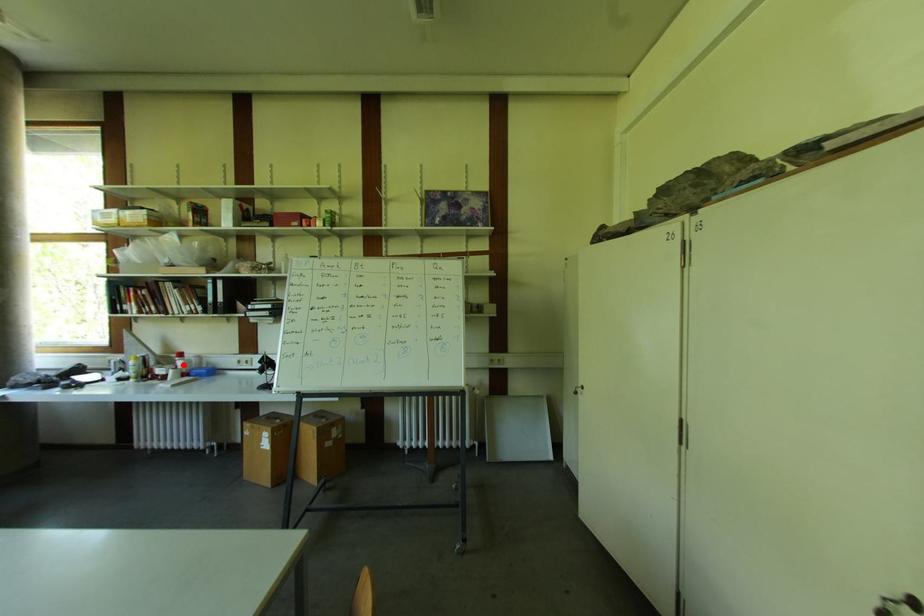
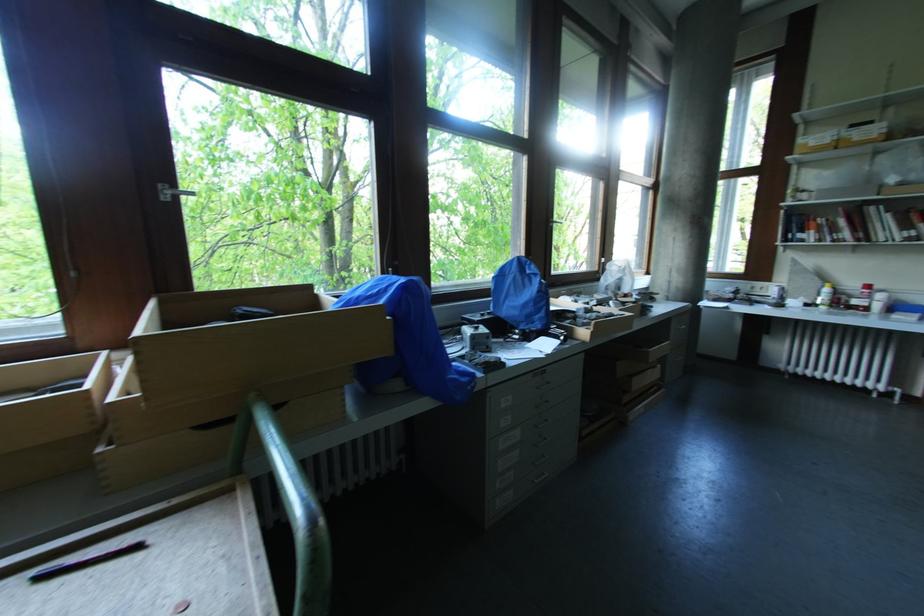
In the second image, find the point that corresponds to the highlighted location in the first image.

(882, 298)